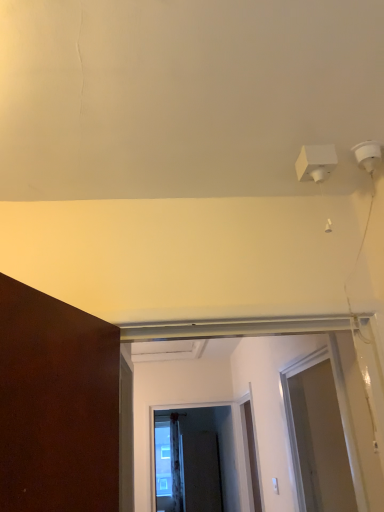
Question: From the image's perspective, relative to black matte screen door at center, which is the first screen door in bottom-to-top order, is clear glass screen door at center, which is the 2th screen door from front to back, above or below?

Choices:
 (A) below
 (B) above

Answer: (B)

Question: Visually, is clear glass screen door at center, the second screen door viewed from the back, positioned to the left or to the right of black matte screen door at center, which is the first screen door in bottom-to-top order?

Choices:
 (A) right
 (B) left

Answer: (B)

Question: Based on their relative distances, which object is nearer to the black matte screen door at center, positioned as the first screen door in back-to-front order?

Choices:
 (A) white matte door at center
 (B) transparent plastic screen door at right, the third screen door viewed from the back
 (C) clear glass screen door at center, which ranks as the 2th screen door in top-to-bottom order

Answer: (C)

Question: Which is nearer to the transparent plastic screen door at right, the third screen door viewed from the back?

Choices:
 (A) clear glass screen door at center, which ranks as the 2th screen door in top-to-bottom order
 (B) white matte door at center
 (C) black matte screen door at center, positioned as the first screen door in back-to-front order

Answer: (B)